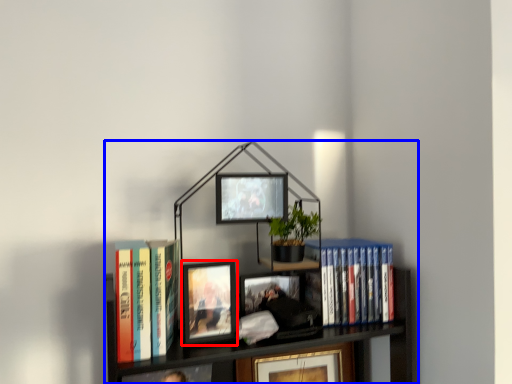
Question: Which object is further to the camera taking this photo, picture frame (highlighted by a red box) or bookcase (highlighted by a blue box)?

Choices:
 (A) picture frame
 (B) bookcase

Answer: (A)